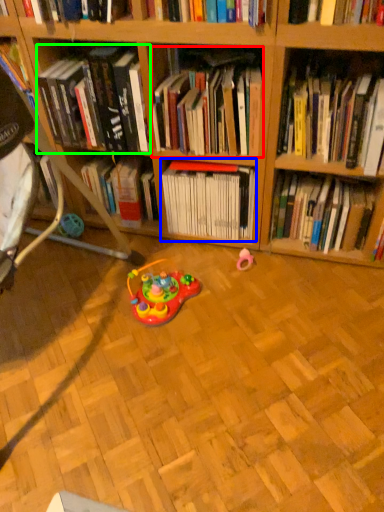
Question: Which object is the farthest from book (highlighted by a red box)? Choose among these: book (highlighted by a blue box) or book (highlighted by a green box).

Choices:
 (A) book
 (B) book

Answer: (A)